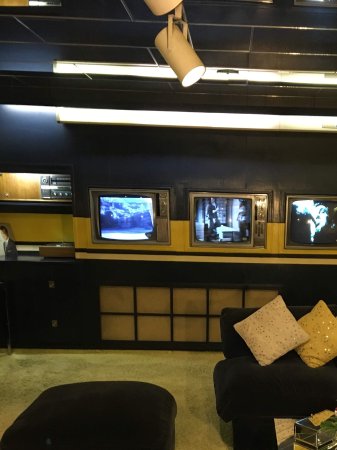
You are a GUI agent. You are given a task and a screenshot of the screen. Output one action in this format:
    pyautogui.click(x=<x>, y=<y>)
    Task: Click on the overhead strip light
    
    Given the screenshot: What is the action you would take?
    pyautogui.click(x=241, y=70), pyautogui.click(x=212, y=122), pyautogui.click(x=42, y=4), pyautogui.click(x=28, y=176)